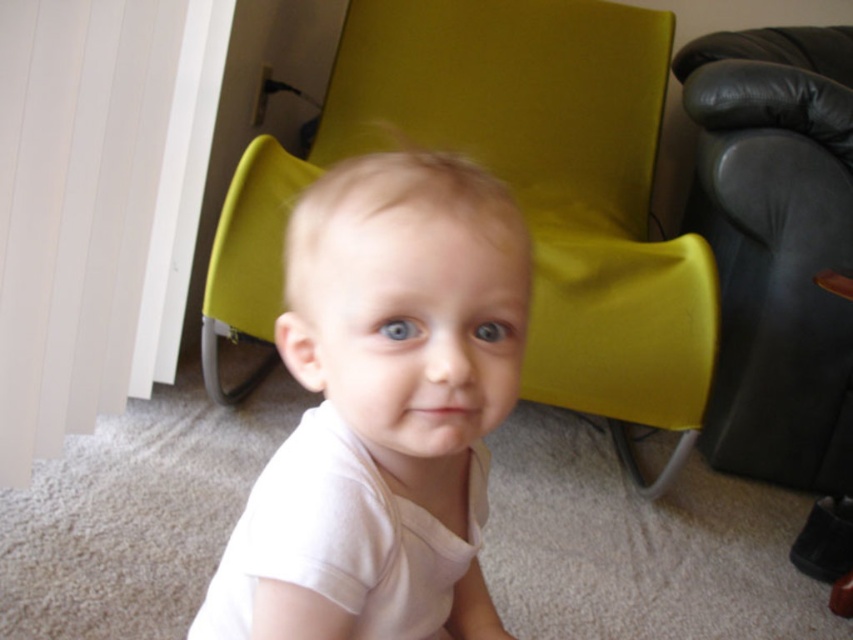
What are the coordinates of the matte green armchair at center?

The matte green armchair at center is located at point (514, 189).

You are a delivery person who needs to place a small package between the white cotton shirt at center and the matte green armchair at center. Can you fit it there if the package is 36 inches long?

The distance between the white cotton shirt at center and the matte green armchair at center is 36.99 inches. Since the package is 36 inches long, it can fit in the space between them.